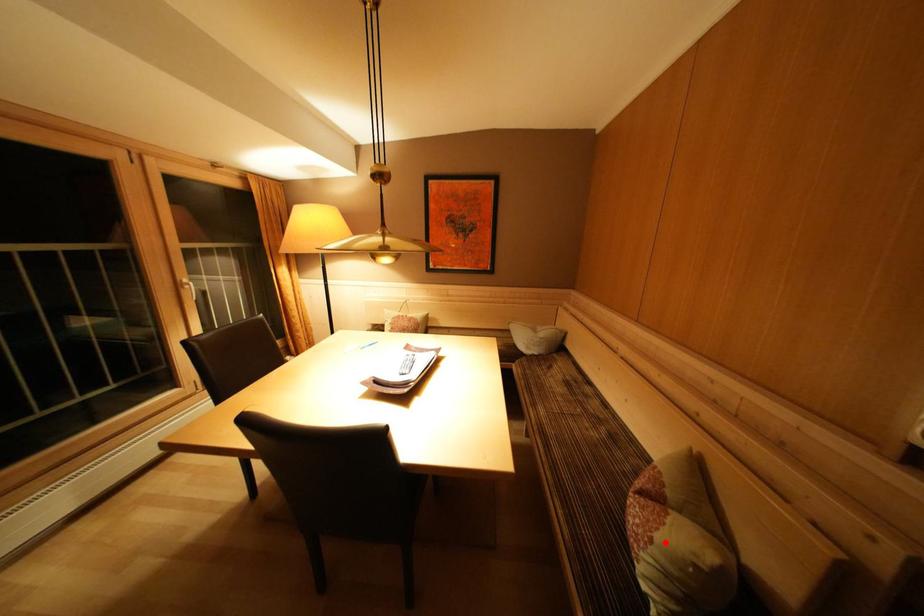
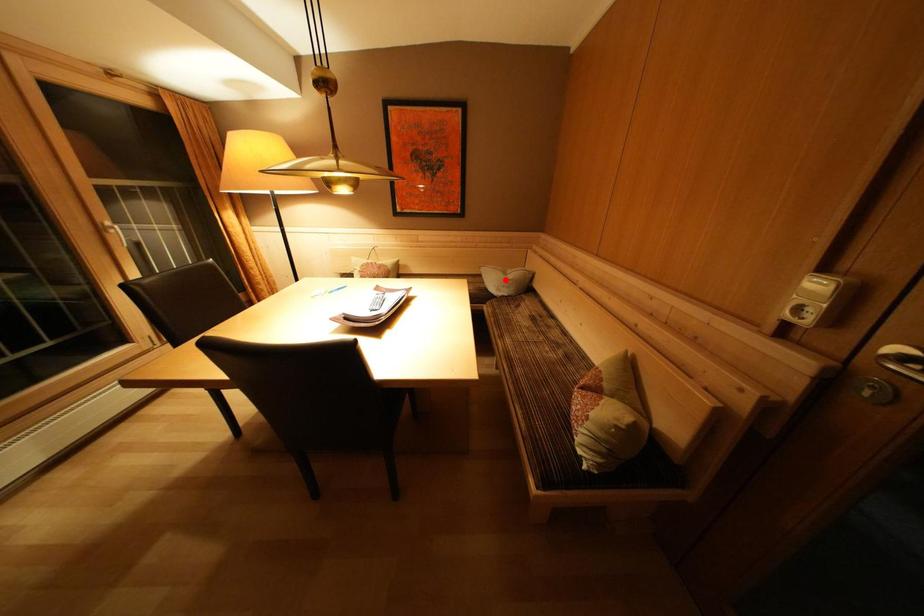
I am providing you with two images of the same scene from different viewpoints. A red point is marked on the first image and another point is marked on the second image. Is the marked point in image1 the same physical position as the marked point in image2?

No